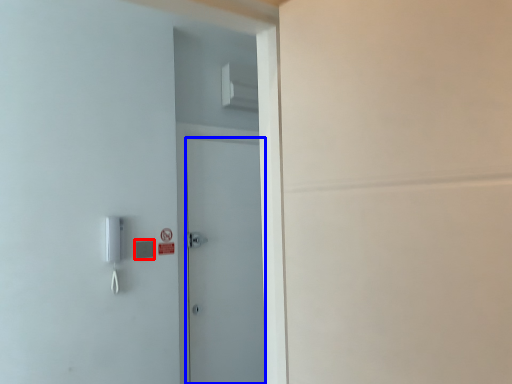
Question: Which point is further to the camera, light switch (highlighted by a red box) or door (highlighted by a blue box)?

Choices:
 (A) light switch
 (B) door

Answer: (B)